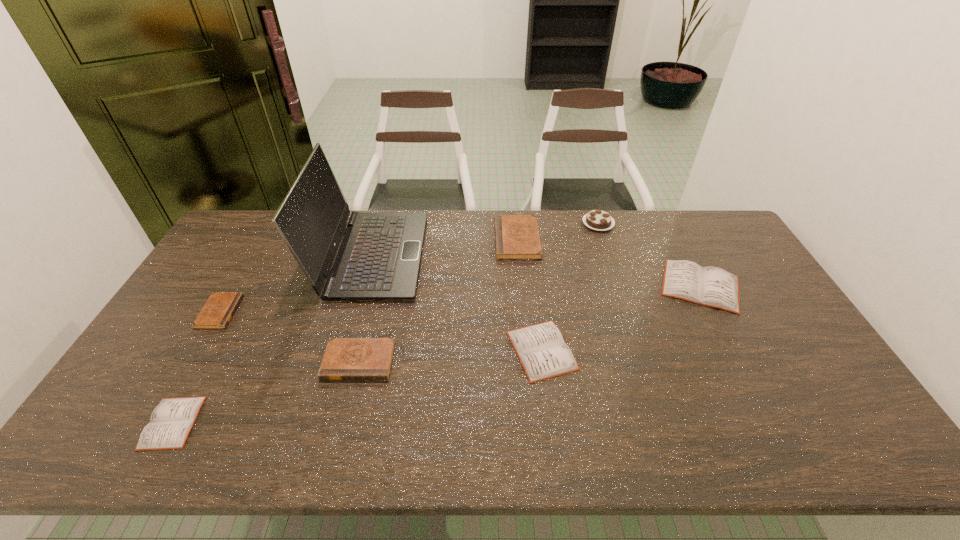
You are a GUI agent. You are given a task and a screenshot of the screen. Output one action in this format:
    pyautogui.click(x=<x>, y=<y>)
    Task: Click on the tallest object
    
    Given the screenshot: What is the action you would take?
    pyautogui.click(x=378, y=259)

Find the location of a particular element. The width and height of the screenshot is (960, 540). laptop computer is located at coordinates (378, 259).

The width and height of the screenshot is (960, 540). Identify the location of the seventh shortest object. pyautogui.click(x=600, y=220).

At what (x,y) coordinates should I click in order to perform the action: click on the second object from right to left. Please return your answer as a coordinate pair (x, y). Looking at the image, I should click on (600, 220).

Image resolution: width=960 pixels, height=540 pixels. I want to click on the third tallest object, so click(x=517, y=237).

You are a GUI agent. You are given a task and a screenshot of the screen. Output one action in this format:
    pyautogui.click(x=<x>, y=<y>)
    Task: Click on the farthest diary
    
    Given the screenshot: What is the action you would take?
    pyautogui.click(x=517, y=237)

Identify the location of the rightmost object. The image size is (960, 540). (711, 286).

Identify the location of the rightmost white diary. (711, 286).

You are a GUI agent. You are given a task and a screenshot of the screen. Output one action in this format:
    pyautogui.click(x=<x>, y=<y>)
    Task: Click on the fourth diary from right to left
    The image size is (960, 540).
    Given the screenshot: What is the action you would take?
    click(x=345, y=358)

Identify the location of the second smallest brown diary. (345, 358).